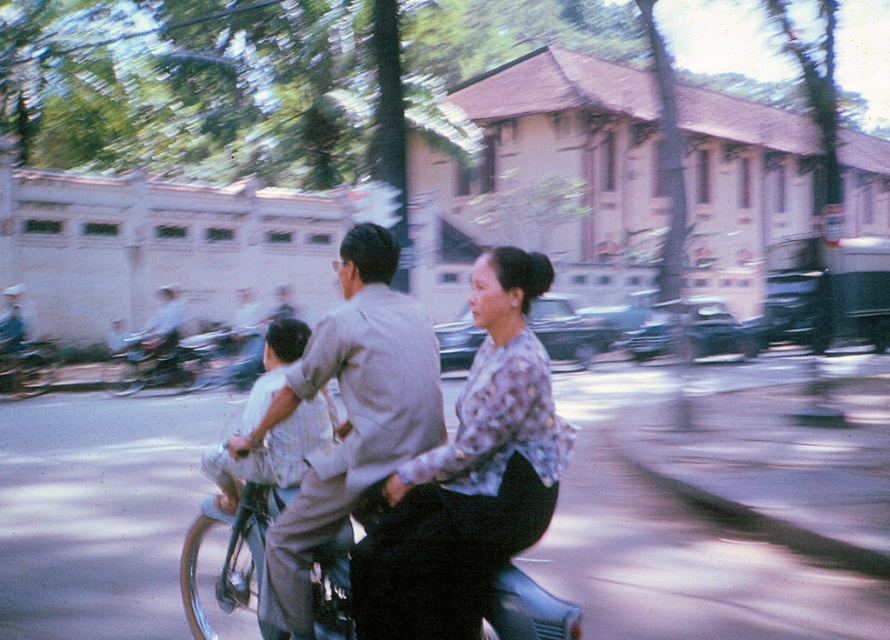
Is floral-patterned blouse at center closer to the viewer compared to light gray shirt at center?

Yes, floral-patterned blouse at center is closer to the viewer.

Which is behind, point (503, 464) or point (407, 387)?

The point (407, 387) is more distant.

At what (x,y) coordinates should I click in order to perform the action: click on floral-patterned blouse at center. Please return your answer as a coordinate pair (x, y). Looking at the image, I should click on (x=470, y=476).